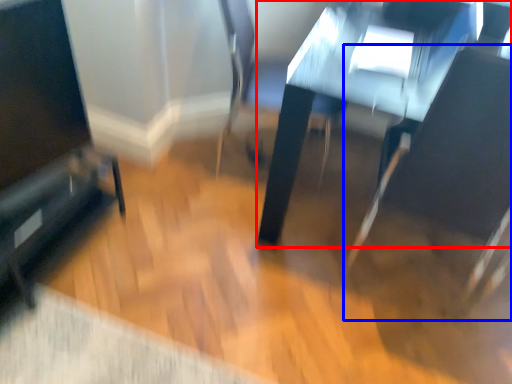
Question: Which object appears farthest to the camera in this image, table (highlighted by a red box) or swivel chair (highlighted by a blue box)?

Choices:
 (A) table
 (B) swivel chair

Answer: (A)